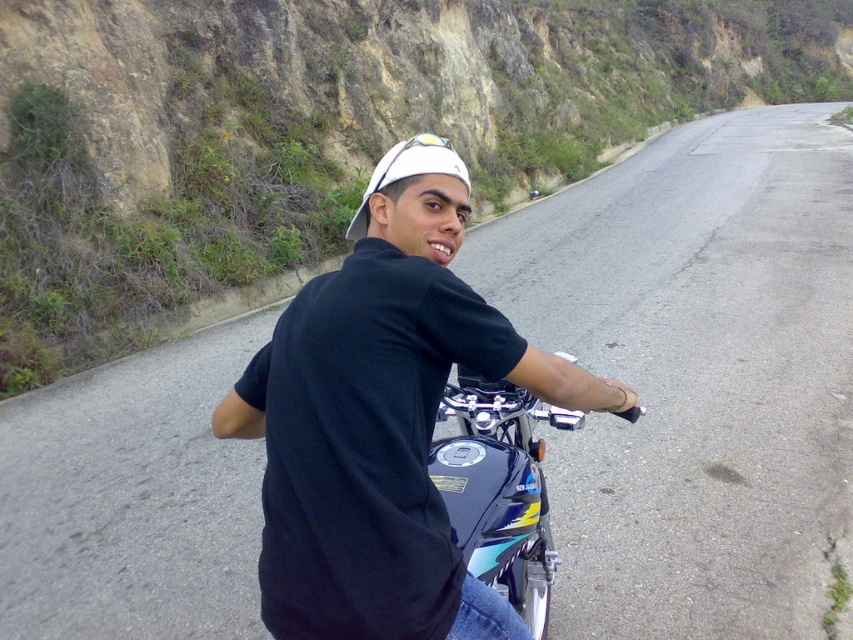
Is black matte shirt at center taller than glossy metallic motorcycle at center?

Yes.

Which is more to the left, black matte shirt at center or glossy metallic motorcycle at center?

black matte shirt at center is more to the left.

This screenshot has height=640, width=853. I want to click on black matte shirt at center, so click(383, 419).

Between black matte shirt at center and white matte baseball cap at center, which one has more height?

With more height is white matte baseball cap at center.

Who is more distant from viewer, (345, 593) or (376, 182)?

Point (376, 182)

Image resolution: width=853 pixels, height=640 pixels. I want to click on black matte shirt at center, so click(x=383, y=419).

Identify the location of glossy metallic motorcycle at center. (500, 488).

Is point (532, 563) less distant than point (393, 180)?

That is False.

Locate an element on the screen. The image size is (853, 640). glossy metallic motorcycle at center is located at coordinates (500, 488).